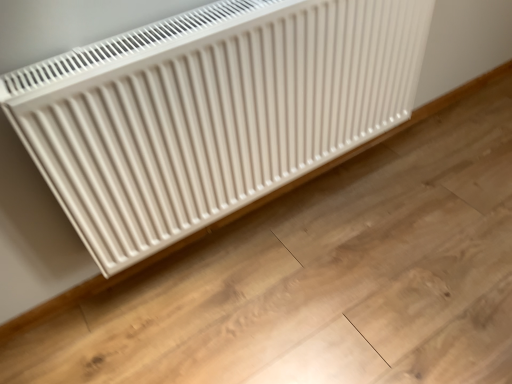
The height and width of the screenshot is (384, 512). Describe the element at coordinates (211, 111) in the screenshot. I see `white matte radiator at center` at that location.

Find the location of a particular element. The image size is (512, 384). white matte radiator at center is located at coordinates (211, 111).

At what (x,y) coordinates should I click in order to perform the action: click on white matte radiator at center. Please return your answer as a coordinate pair (x, y). Image resolution: width=512 pixels, height=384 pixels. Looking at the image, I should click on (211, 111).